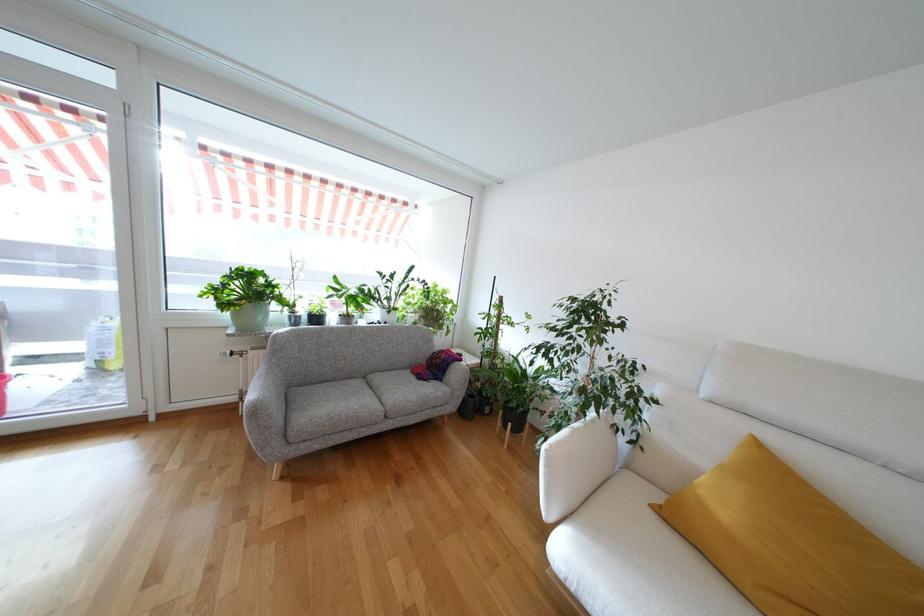
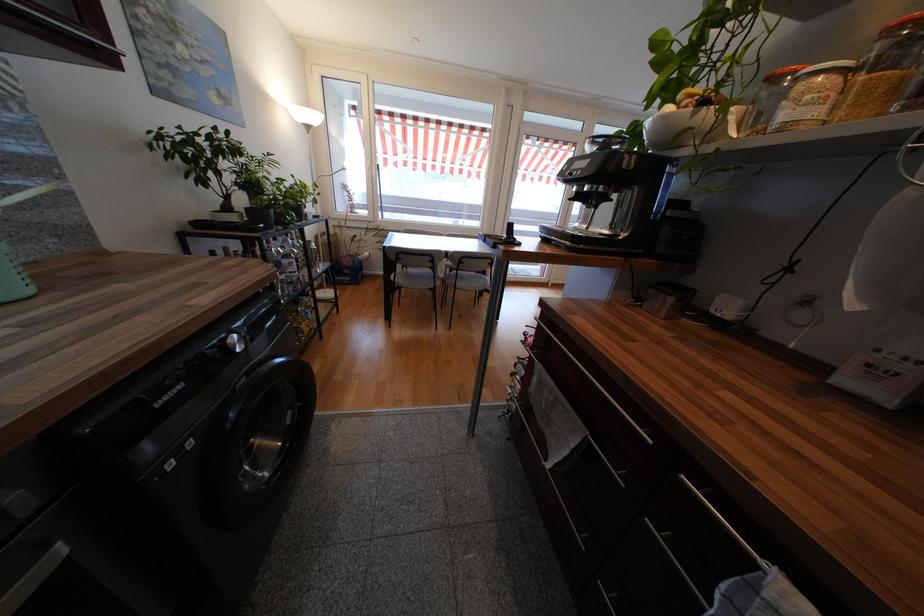
In a continuous first-person perspective shot, in which direction is the camera moving?

The cameraman moved toward left, backward.